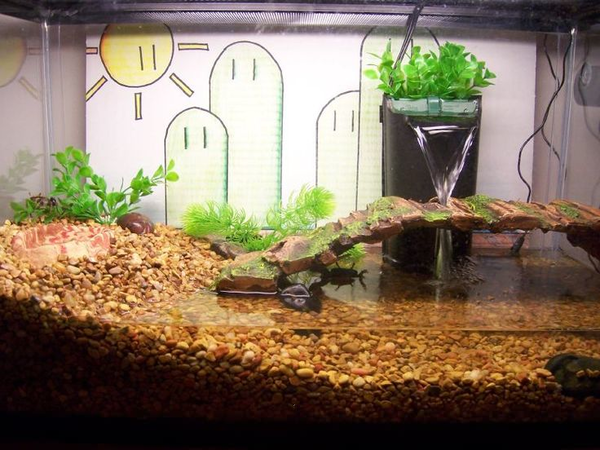
At what (x,y) coordinates should I click in order to perform the action: click on water filter. Please return your answer as a coordinate pair (x, y). This screenshot has height=450, width=600. Looking at the image, I should click on (398, 158).